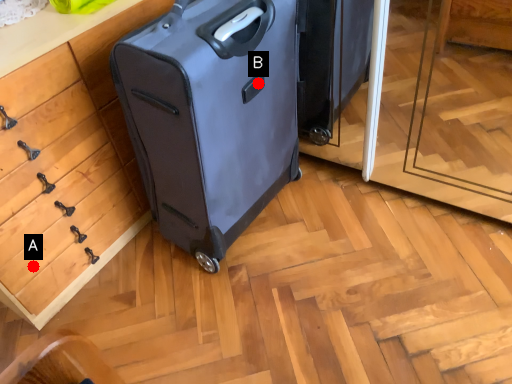
Question: Two points are circled on the image, labeled by A and B beside each circle. Which of the following is the closest to the observer?

Choices:
 (A) A is closer
 (B) B is closer

Answer: (B)